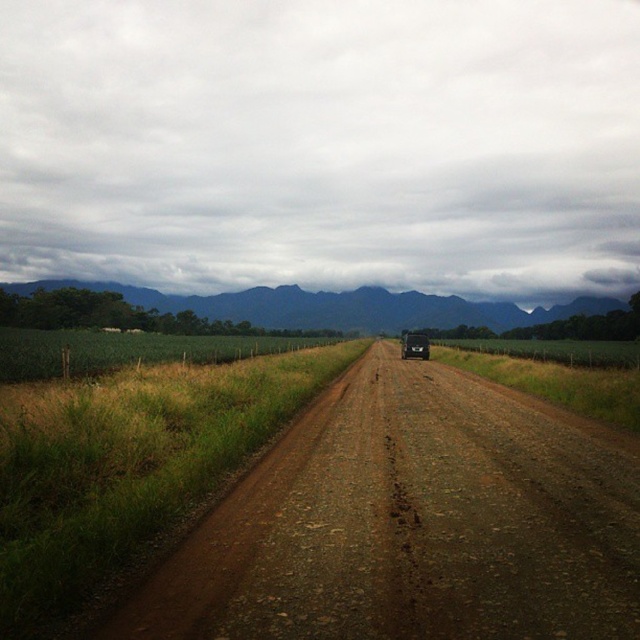
You are standing on the dirt road in the rural scene and want to walk towards the point that is closer to you. Which point should you head towards, point (168, 310) or point (401, 344)?

You should head towards point (401, 344) because it is closer to you than point (168, 310).

You are driving a car and see the image. There is a green grassy field at upper center and a black matte bus at center. Which object is closer to you from your perspective?

The green grassy field at upper center is closer to you because the black matte bus at center is behind it.